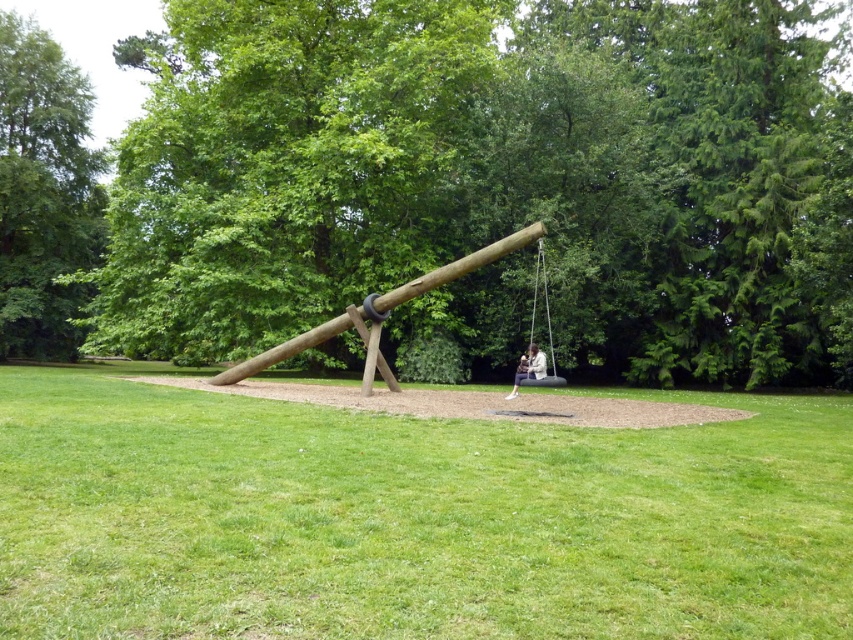
Question: Which object is positioned closest to the brown wood swing at center?

Choices:
 (A) white fabric swing at center
 (B) wooden pole at center
 (C) green grassy at center
 (D) green leafy tree at left

Answer: (B)

Question: Which object is closer to the camera taking this photo?

Choices:
 (A) green leafy tree at left
 (B) green grassy at center
 (C) wooden pole at center
 (D) brown wood swing at center

Answer: (B)

Question: Is green grassy at center smaller than light brown wooden swing at center?

Choices:
 (A) no
 (B) yes

Answer: (A)

Question: Is green grassy at center thinner than white fabric swing at center?

Choices:
 (A) yes
 (B) no

Answer: (B)

Question: Observing the image, what is the correct spatial positioning of brown wood swing at center in reference to green grassy at center?

Choices:
 (A) left
 (B) right

Answer: (A)

Question: Which point is closer to the camera?

Choices:
 (A) green grassy at center
 (B) wooden pole at center

Answer: (A)